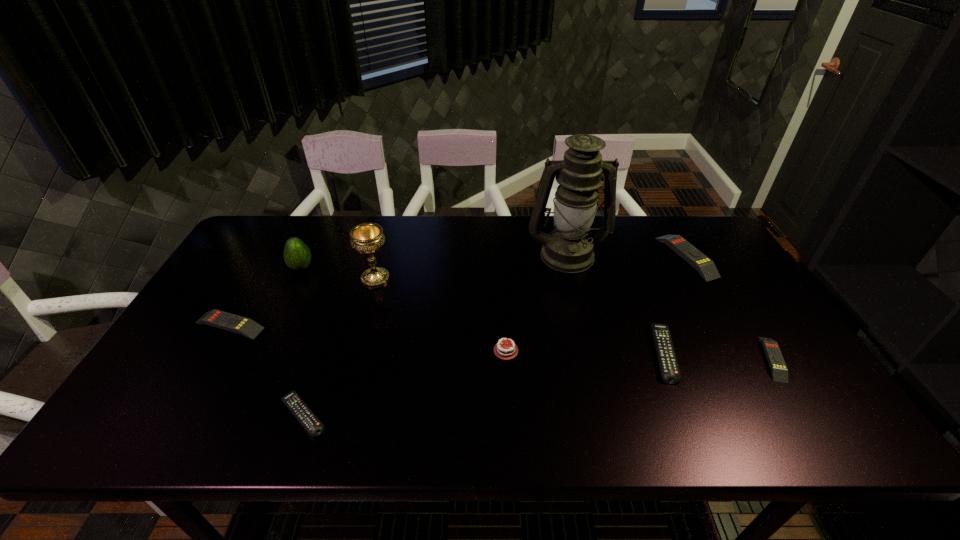
Identify the location of empty space that is in between the eighth shortest object and the fourth object from right to left. (471, 266).

At what (x,y) coordinates should I click in order to perform the action: click on free space between the tallest object and the smaller black remote control. Please return your answer as a coordinate pair (x, y). Looking at the image, I should click on click(435, 334).

Identify the location of free space that is in between the bigger black remote control and the second tallest remote control. This screenshot has width=960, height=540. (446, 339).

Identify the location of unoccupied position between the fourth shortest object and the bigger black remote control. (446, 339).

Locate which object ranks fifth in proximity to the seventh shortest object. Please provide its 2D coordinates. Your answer should be formatted as a tuple, i.e. [(x, y)], where the tuple contains the x and y coordinates of a point satisfying the conditions above.

[(569, 249)]

You are a GUI agent. You are given a task and a screenshot of the screen. Output one action in this format:
    pyautogui.click(x=<x>, y=<y>)
    Task: Click on the object that stands as the eighth closest to the tallest object
    This screenshot has width=960, height=540.
    Given the screenshot: What is the action you would take?
    click(247, 327)

Locate which remote control is the third closest to the tallest remote control. Please provide its 2D coordinates. Your answer should be formatted as a tuple, i.e. [(x, y)], where the tuple contains the x and y coordinates of a point satisfying the conditions above.

[(292, 400)]

Identify which remote control is the second nearest to the fourth remote control from right to left. Please provide its 2D coordinates. Your answer should be formatted as a tuple, i.e. [(x, y)], where the tuple contains the x and y coordinates of a point satisfying the conditions above.

[(669, 368)]

Select which yellow remote control appears as the third closest to the green avocado. Please provide its 2D coordinates. Your answer should be formatted as a tuple, i.e. [(x, y)], where the tuple contains the x and y coordinates of a point satisfying the conditions above.

[(779, 371)]

Locate which yellow remote control is the closest to the chalice. Please provide its 2D coordinates. Your answer should be formatted as a tuple, i.e. [(x, y)], where the tuple contains the x and y coordinates of a point satisfying the conditions above.

[(247, 327)]